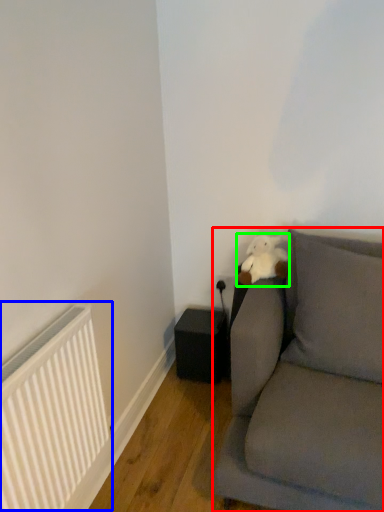
Question: Which is nearer to the studio couch (highlighted by a red box)? radiator (highlighted by a blue box) or teddy (highlighted by a green box).

Choices:
 (A) radiator
 (B) teddy

Answer: (B)